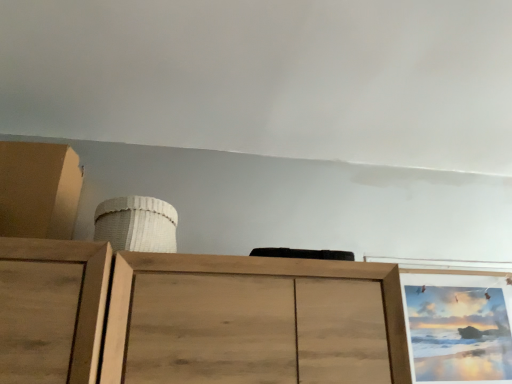
Question: Is white woven basket at upper center behind wooden picture frame at upper right?

Choices:
 (A) yes
 (B) no

Answer: (B)

Question: Is white woven basket at upper center turned away from wooden picture frame at upper right?

Choices:
 (A) no
 (B) yes

Answer: (A)

Question: From the image's perspective, is white woven basket at upper center below wooden picture frame at upper right?

Choices:
 (A) no
 (B) yes

Answer: (A)

Question: Does white woven basket at upper center have a greater width compared to wooden picture frame at upper right?

Choices:
 (A) no
 (B) yes

Answer: (B)

Question: From the image's perspective, is white woven basket at upper center above wooden picture frame at upper right?

Choices:
 (A) no
 (B) yes

Answer: (B)

Question: Can you confirm if white woven basket at upper center is thinner than wooden picture frame at upper right?

Choices:
 (A) yes
 (B) no

Answer: (B)

Question: From the image's perspective, is white woven basket at upper center located beneath matte brown cabinet at upper left?

Choices:
 (A) yes
 (B) no

Answer: (A)

Question: Is white woven basket at upper center looking in the opposite direction of matte brown cabinet at upper left?

Choices:
 (A) yes
 (B) no

Answer: (B)

Question: Can you confirm if white woven basket at upper center is shorter than matte brown cabinet at upper left?

Choices:
 (A) yes
 (B) no

Answer: (A)

Question: From a real-world perspective, is white woven basket at upper center located higher than matte brown cabinet at upper left?

Choices:
 (A) yes
 (B) no

Answer: (B)

Question: Is the surface of white woven basket at upper center in direct contact with matte brown cabinet at upper left?

Choices:
 (A) no
 (B) yes

Answer: (A)

Question: Is white woven basket at upper center completely or partially outside of matte brown cabinet at upper left?

Choices:
 (A) yes
 (B) no

Answer: (A)

Question: Considering the relative sizes of wooden picture frame at upper right and matte brown cabinet at upper left in the image provided, is wooden picture frame at upper right smaller than matte brown cabinet at upper left?

Choices:
 (A) no
 (B) yes

Answer: (B)